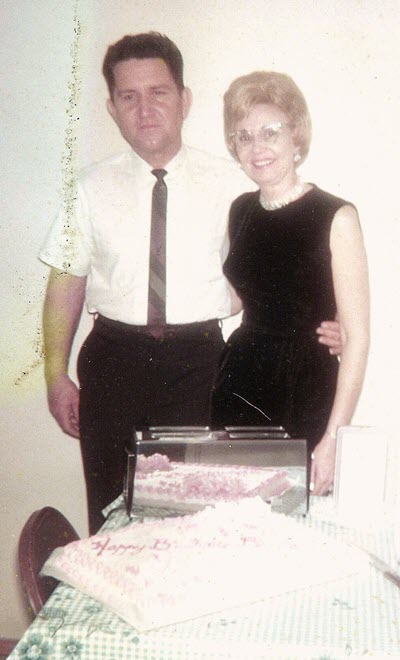
Find the location of `chair`. chair is located at coordinates (38, 550).